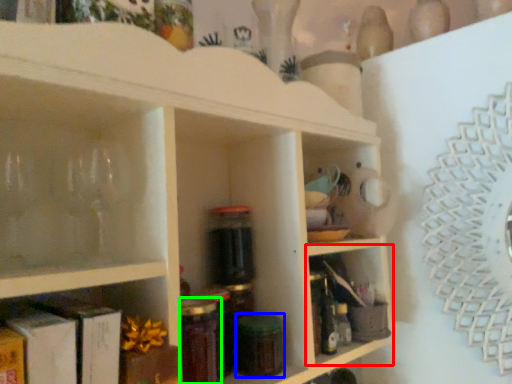
Question: Which is nearer to the shelf (highlighted by a red box)? glass jar (highlighted by a blue box) or bottle (highlighted by a green box).

Choices:
 (A) glass jar
 (B) bottle

Answer: (A)